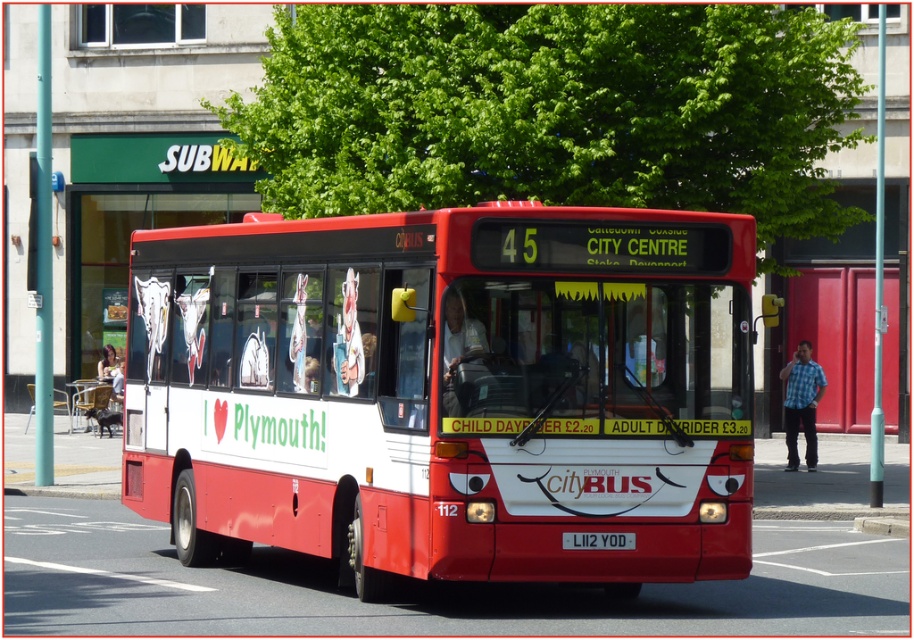
Consider the image. You are a pedestrian standing on the sidewalk and see the matte red bus at center and the white plastic license plate at center. Which object is closer to the right side of the image?

The matte red bus at center is closer to the right side of the image because it is positioned to the right of the white plastic license plate at center.